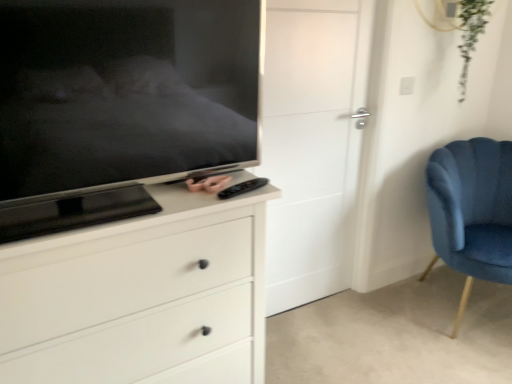
Find the location of a particular element. The width and height of the screenshot is (512, 384). free space to the left of black plastic remote at center is located at coordinates (183, 200).